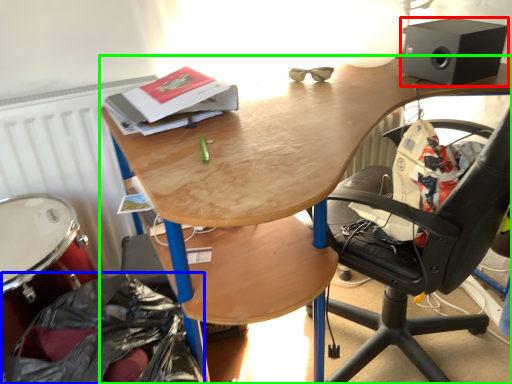
Question: Considering the real-world distances, which object is closest to loudspeaker (highlighted by a red box)? garbage (highlighted by a blue box) or desk (highlighted by a green box).

Choices:
 (A) garbage
 (B) desk

Answer: (B)